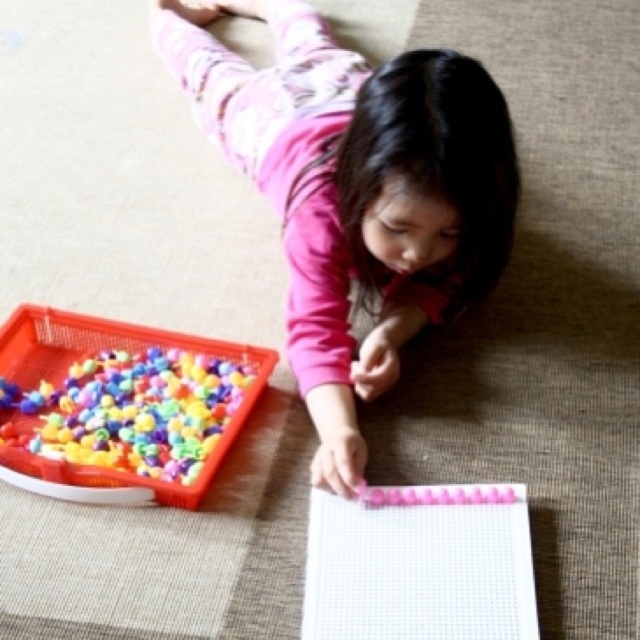
You are a parent trying to organize the play area. You need to place a larger storage box on the side of the pink matte fabric at center and the multicolored plastic beads at lower left. Which side should you choose to ensure the box fits?

The pink matte fabric at center is wider than the multicolored plastic beads at lower left, so you should place the larger storage box on the side of the pink matte fabric at center to ensure it fits.

You are a toy organizer who needs to place a new toy that is 16 inches long between the pink matte fabric at center and the multicolored plastic beads at lower left. Can the toy fit in the space between them?

The distance between the pink matte fabric at center and the multicolored plastic beads at lower left is 17.36 inches. Since the toy is 16 inches long, it can fit in the space between them as there is enough room.